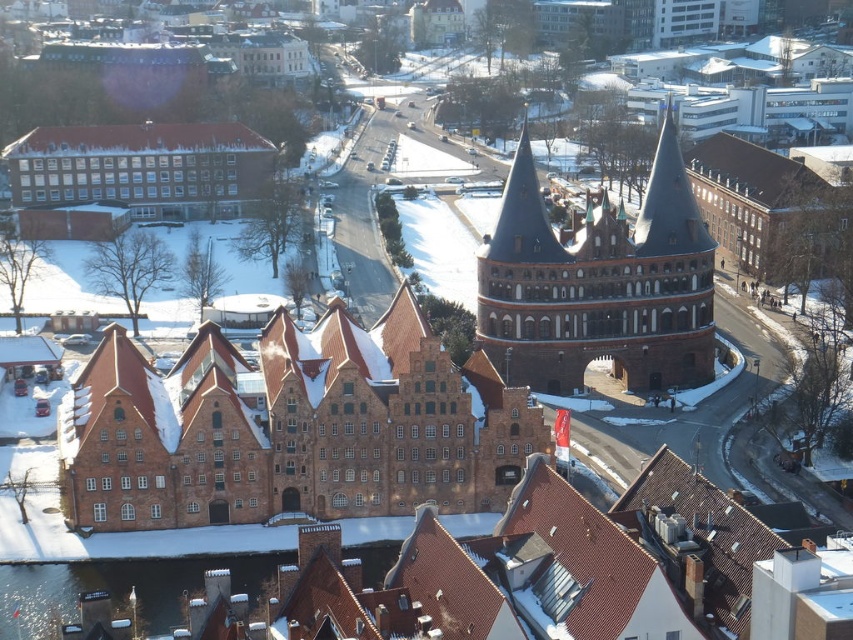
You are a tour guide leading a group through the snowy town. You want to highlight the architectural differences between the brown brick building at center and the brown stone tower at center. Which one is wider?

The brown brick building at center is wider than the brown stone tower at center because its width surpasses the tower.

You are a tourist visiting the town and want to take a photo of both the brown brick building at center and the brown stone tower at center. Which one should you focus on first to ensure both are in the frame?

You should focus on the brown stone tower at center first because it is larger than the brown brick building at center, so positioning it properly will help ensure both fit in the frame.

You are a tourist standing in the snowy town square and see the brown brick building at center and the brown stone tower at center. Which one is located to the left of the other?

The brown brick building at center is positioned on the left side of brown stone tower at center.